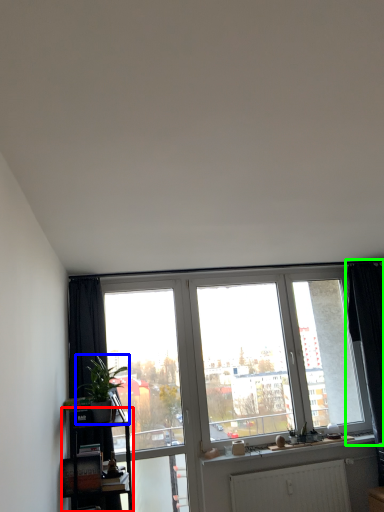
Question: Estimate the real-world distances between objects in this image. Which object is closer to shelf (highlighted by a red box), houseplant (highlighted by a blue box) or curtain (highlighted by a green box)?

Choices:
 (A) houseplant
 (B) curtain

Answer: (A)